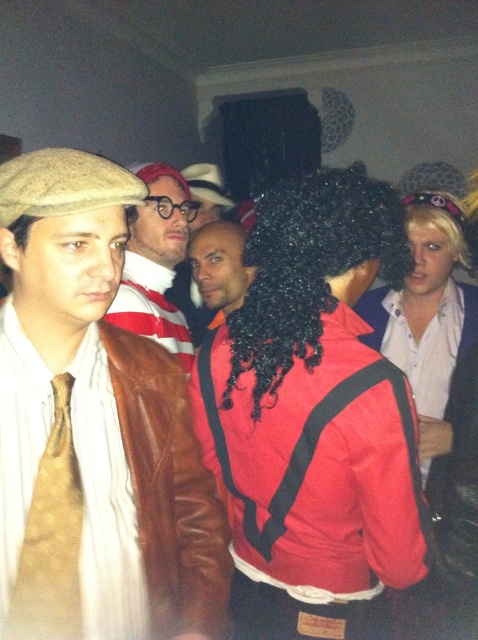
Question: Which point appears farthest from the camera in this image?

Choices:
 (A) (158, 339)
 (B) (113, 241)

Answer: (A)

Question: Which of the following is the closest to the observer?

Choices:
 (A) (54, 524)
 (B) (417, 298)

Answer: (A)

Question: Does matte white shirt at center have a larger size compared to satin black wig at center?

Choices:
 (A) yes
 (B) no

Answer: (A)

Question: From the image, what is the correct spatial relationship of matte brown leather jacket at center in relation to shiny black wig at center?

Choices:
 (A) below
 (B) above

Answer: (B)

Question: Which of the following is the closest to the observer?

Choices:
 (A) gold textured tie at left
 (B) striped wool sweater at center
 (C) matte white shirt at center
 (D) satin black wig at center

Answer: (A)

Question: From the image, what is the correct spatial relationship of matte brown leather jacket at center in relation to striped wool sweater at center?

Choices:
 (A) right
 (B) left

Answer: (A)